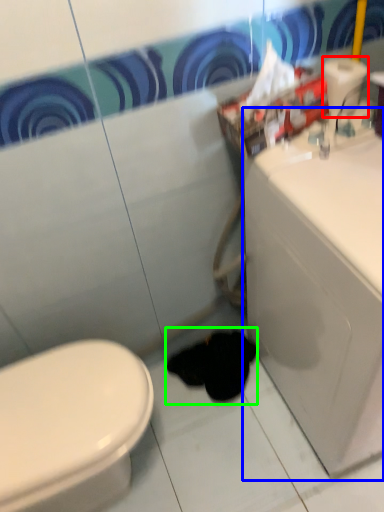
Question: Which is nearer to the toilet paper (highlighted by a red box)? porcelain (highlighted by a blue box) or animal (highlighted by a green box).

Choices:
 (A) porcelain
 (B) animal

Answer: (A)